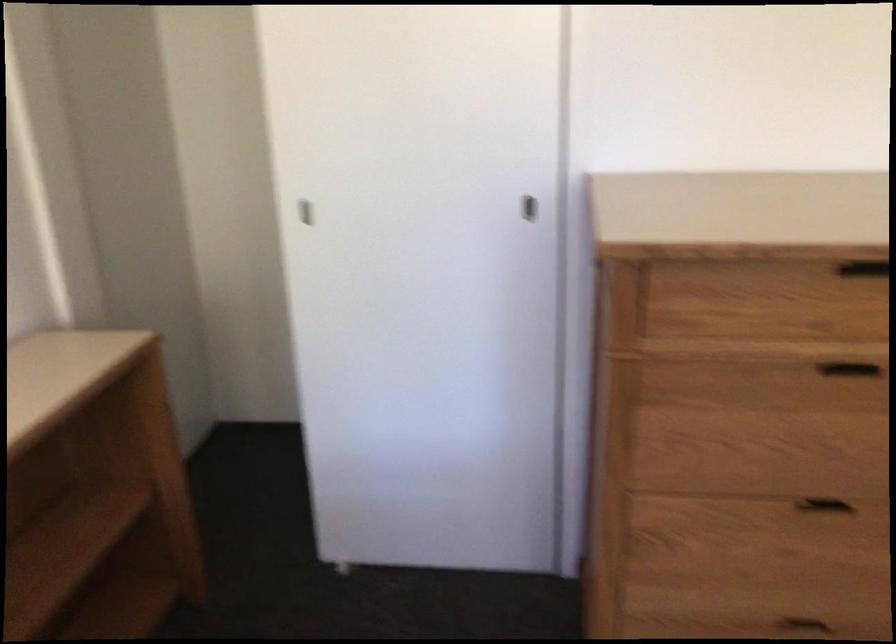
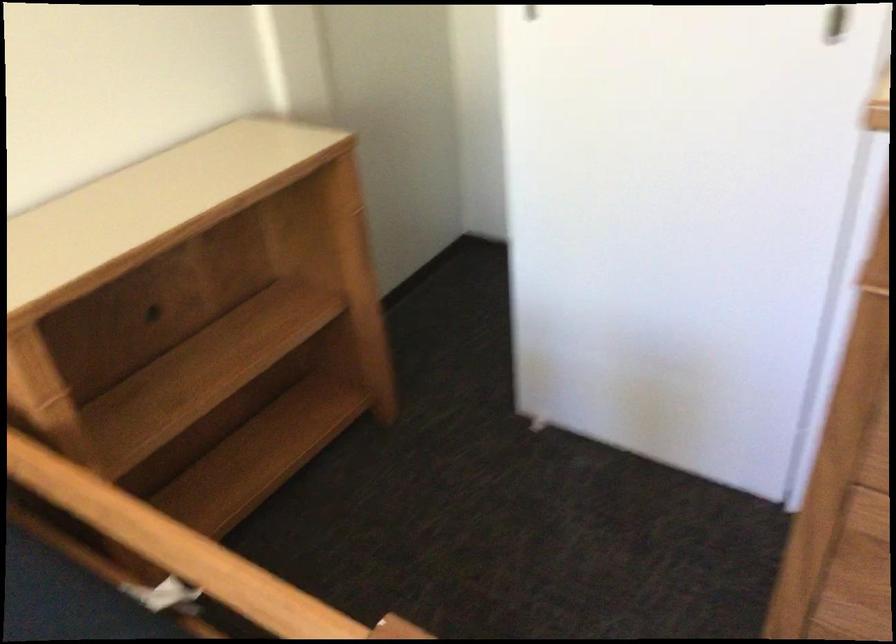
Which direction would the cameraman need to move to produce the second image?

The cameraman walked toward right, forward.